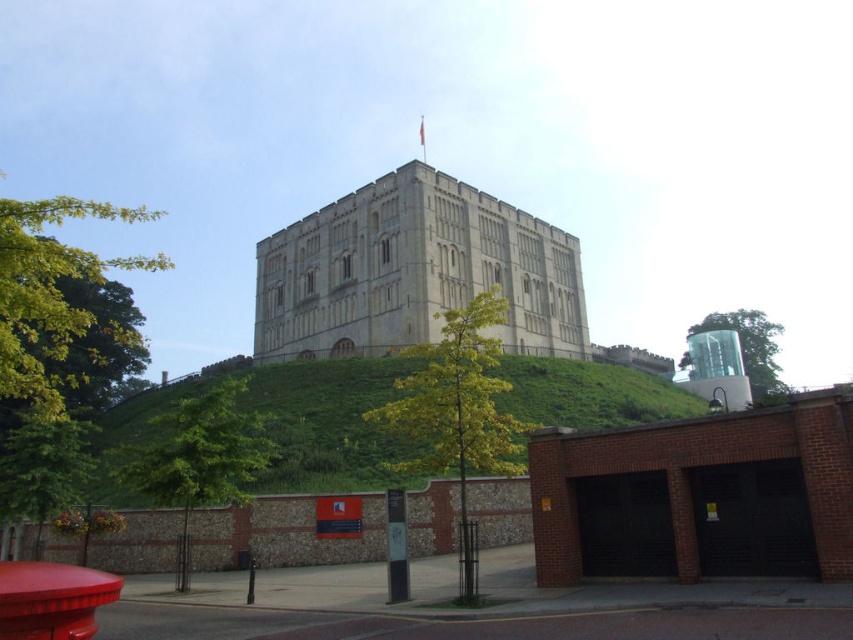
From the picture: Is beige stone castle at center further to camera compared to green leafy tree at center?

Yes, it is behind green leafy tree at center.

Where is `beige stone castle at center`? The image size is (853, 640). beige stone castle at center is located at coordinates (415, 272).

Is green grassy hillside at upper center smaller than green leafy tree at center?

No, green grassy hillside at upper center is not smaller than green leafy tree at center.

Between green grassy hillside at upper center and green leafy tree at center, which one has more height?

green leafy tree at center

The height and width of the screenshot is (640, 853). I want to click on green grassy hillside at upper center, so click(x=283, y=426).

Can you confirm if green grassy hillside at upper center is positioned below green leafy tree at lower left?

Incorrect, green grassy hillside at upper center is not positioned below green leafy tree at lower left.

Which is more to the right, green grassy hillside at upper center or green leafy tree at lower left?

green grassy hillside at upper center is more to the right.

What do you see at coordinates (283, 426) in the screenshot? I see `green grassy hillside at upper center` at bounding box center [283, 426].

Find the location of `green grassy hillside at upper center`. green grassy hillside at upper center is located at coordinates [283, 426].